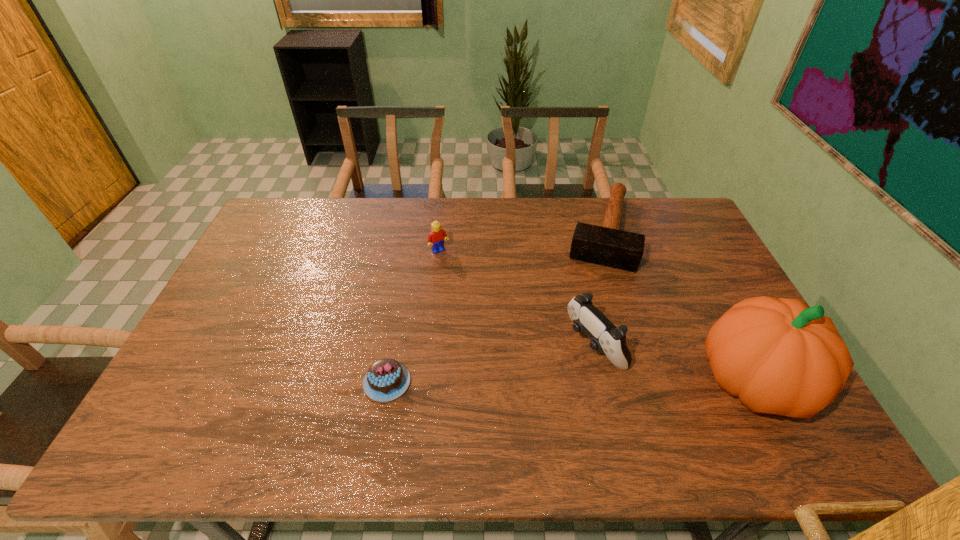
Locate an element on the screen. free spot on the desktop that is between the shortest object and the pumpkin and is positioned on the striking face of the mallet is located at coordinates coord(564,382).

Find the location of a particular element. vacant space on the desktop that is between the shortest object and the tallest object and is positioned on the front-facing side of the third tallest object is located at coordinates (x=540, y=382).

The width and height of the screenshot is (960, 540). I want to click on free spot on the desktop that is between the leftmost object and the pumpkin and is positioned on the front-facing side of the control, so click(x=524, y=382).